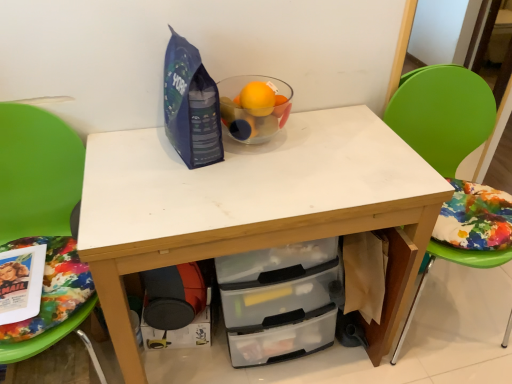
Question: Is transparent glass bowl at center inside the boundaries of green fabric chair at left, the first chair in the left-to-right sequence, or outside?

Choices:
 (A) outside
 (B) inside

Answer: (A)

Question: Considering the positions of transparent glass bowl at center and green fabric chair at left, the first chair in the left-to-right sequence, in the image, is transparent glass bowl at center taller or shorter than green fabric chair at left, the first chair in the left-to-right sequence,?

Choices:
 (A) short
 (B) tall

Answer: (A)

Question: Considering the real-world distances, which object is farthest from the transparent glass bowl at center?

Choices:
 (A) green fabric chair at left, which is counted as the 2th chair, starting from the right
 (B) white matte table at center
 (C) green plastic chair at right, the 2th chair from the left
 (D) black plastic drawer at lower center

Answer: (D)

Question: Which object is the closest to the green fabric chair at left, which is counted as the 2th chair, starting from the right?

Choices:
 (A) black plastic drawer at lower center
 (B) green plastic chair at right, the 2th chair from the left
 (C) transparent glass bowl at center
 (D) white matte table at center

Answer: (D)